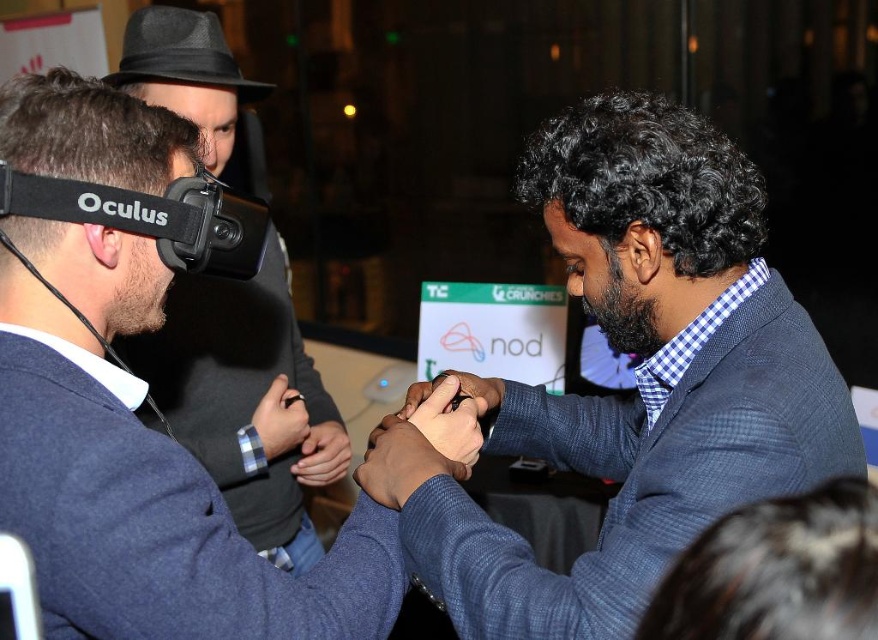
Question: Which of the following is the closest to the observer?

Choices:
 (A) (739, 509)
 (B) (293, 476)

Answer: (A)

Question: Does blue sweater at center have a greater width compared to dark gray felt fedora at upper left?

Choices:
 (A) yes
 (B) no

Answer: (A)

Question: Which is farther from the dark blue fabric at lower right?

Choices:
 (A) matte black vr headset at left
 (B) blue textured suit at center

Answer: (A)

Question: Is blue sweater at center to the left of matte black vr headset at left from the viewer's perspective?

Choices:
 (A) no
 (B) yes

Answer: (A)

Question: Based on their relative distances, which object is nearer to the blue sweater at center?

Choices:
 (A) dark gray felt fedora at upper left
 (B) dark blue fabric at lower right

Answer: (B)

Question: Is blue sweater at center to the right of matte black vr headset at left from the viewer's perspective?

Choices:
 (A) yes
 (B) no

Answer: (A)